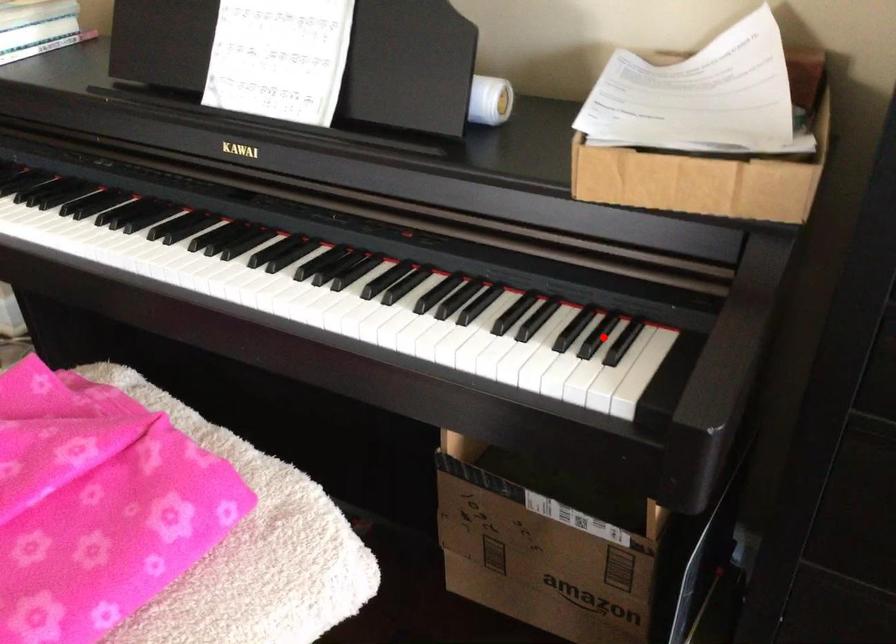
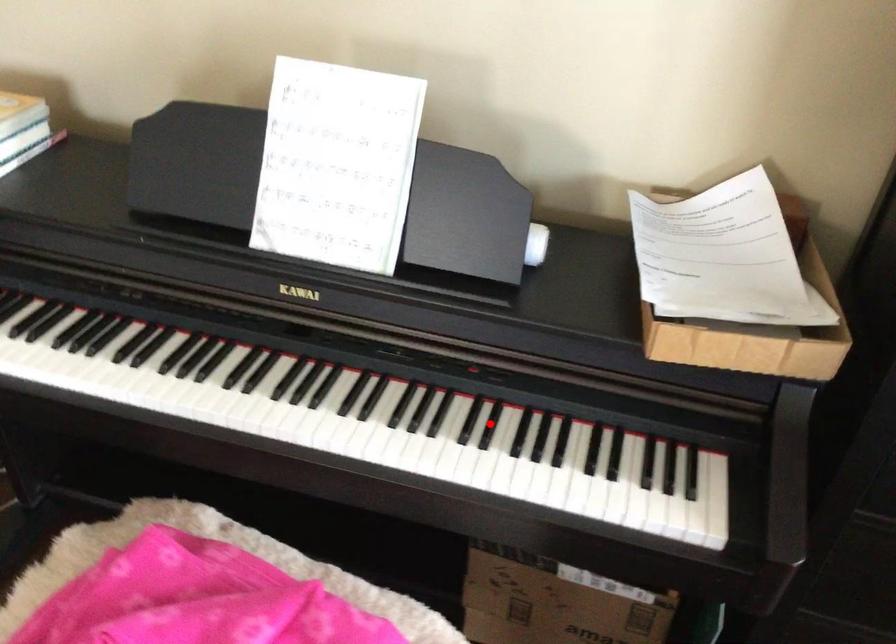
I am providing you with two images of the same scene from different viewpoints. A red point is marked on the first image and another point is marked on the second image. Does the point marked in image1 correspond to the same location as the one in image2?

No